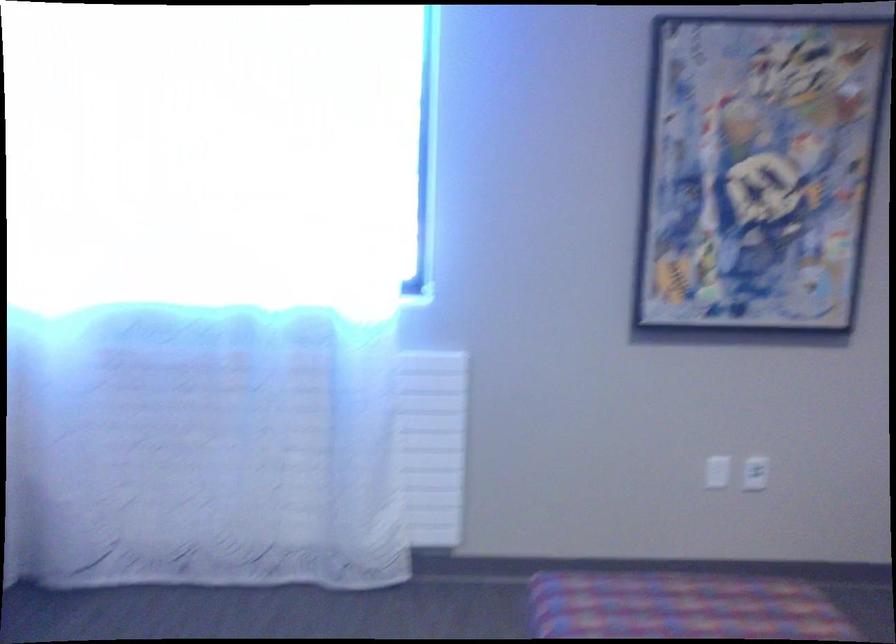
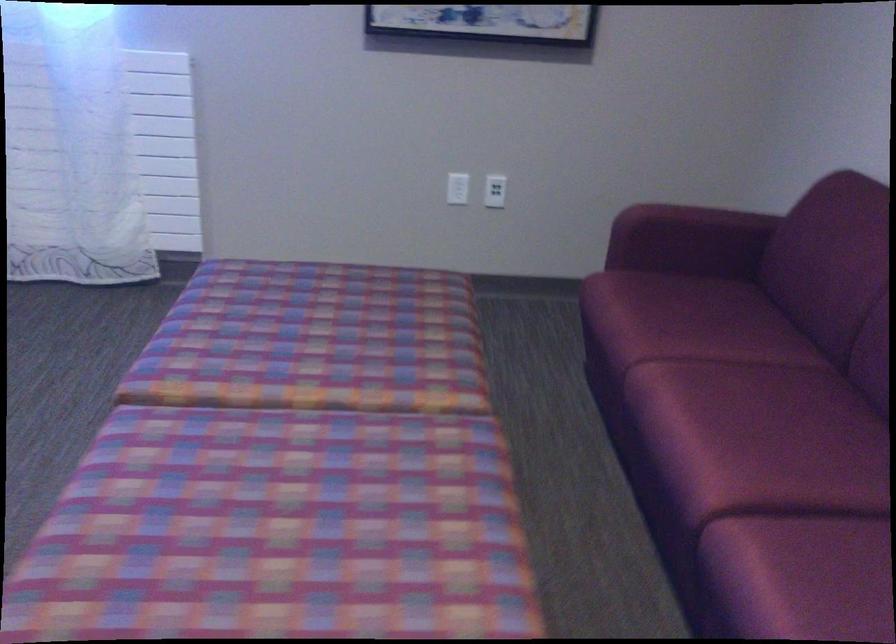
Question: What movement of the cameraman would produce the second image?

Choices:
 (A) Left
 (B) Right
 (C) Forward
 (D) Backward

Answer: (B)